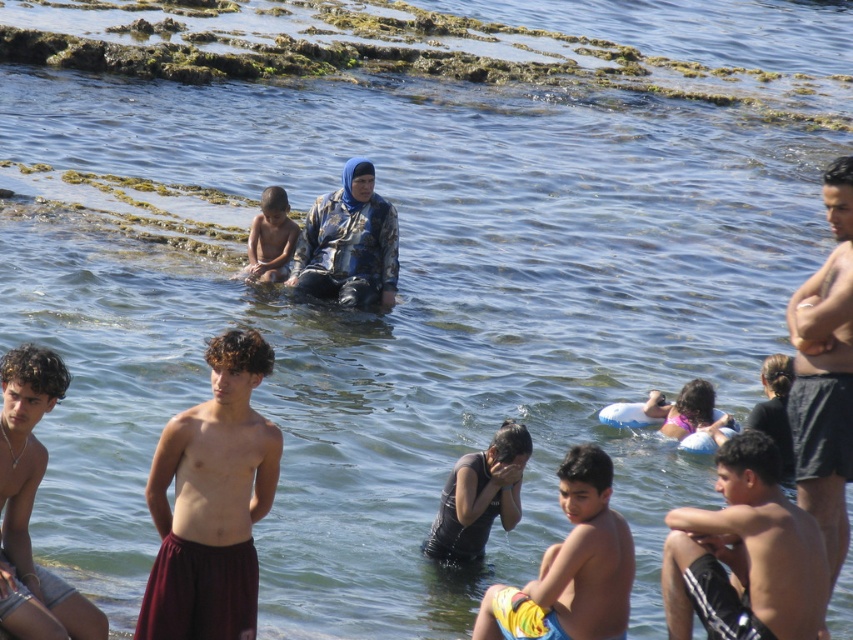
Question: Which point is closer to the camera?

Choices:
 (A) smooth skin boy at center
 (B) purple swimsuit at center
 (C) maroon fabric shorts at center

Answer: (C)

Question: Is maroon fabric shorts at center to the left of camouflage fabric jacket at center from the viewer's perspective?

Choices:
 (A) yes
 (B) no

Answer: (A)

Question: Considering the real-world distances, which object is closest to the camouflage fabric jacket at center?

Choices:
 (A) dark blue shorts at right
 (B) smooth skin boy at center
 (C) purple swimsuit at center

Answer: (C)

Question: Is the position of shiny black shorts at lower right less distant than that of purple swimsuit at center?

Choices:
 (A) yes
 (B) no

Answer: (A)

Question: Does shiny black shorts at lower right have a smaller size compared to purple swimsuit at center?

Choices:
 (A) no
 (B) yes

Answer: (A)

Question: Among these points, which one is nearest to the camera?

Choices:
 (A) [698, 614]
 (B) [215, 477]

Answer: (B)